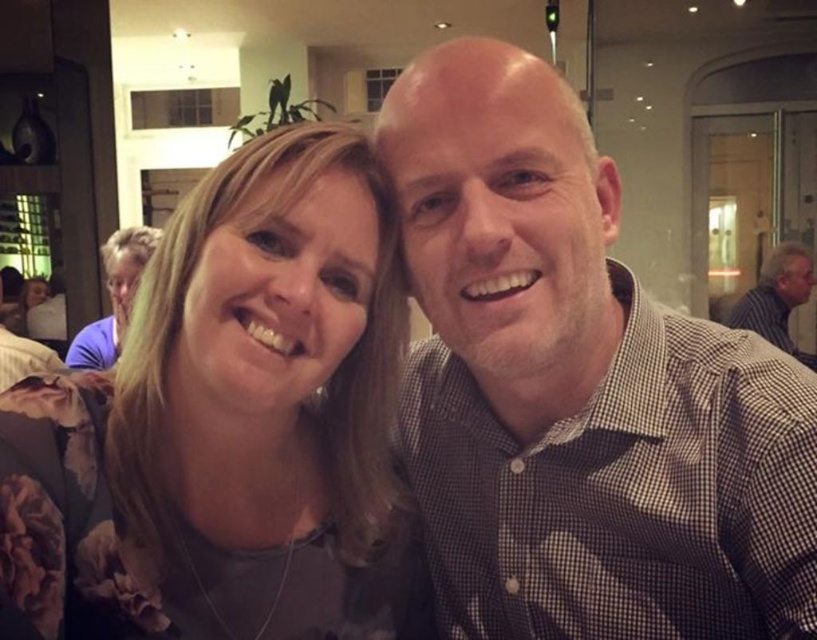
You are a photographer standing at the camera position. You want to adjust the lighting to focus on the matte purple shirt at upper left. Since the shirt is 2.54 meters away from the camera, what is the minimum distance you should set your camera flash to reach it?

The minimum distance you should set your camera flash to reach the matte purple shirt at upper left is 2.54 meters, as that is the distance between them.

Looking at this image, you are a photographer adjusting your camera settings to focus on the checkered fabric shirt at center and the floral fabric shirt at left. Which shirt should you focus on first to ensure both are in focus?

You should focus on the checkered fabric shirt at center first because it is closer to the viewer than the floral fabric shirt at left, ensuring both will be in focus when starting with the closer object.

You are a photographer trying to capture a clear shot of both the checkered fabric shirt at center and the striped shirt at right. Which shirt should you focus on first to ensure both are in focus?

The checkered fabric shirt at center is positioned under the striped shirt at right, so you should focus on the checkered fabric shirt at center first to ensure both are in focus.